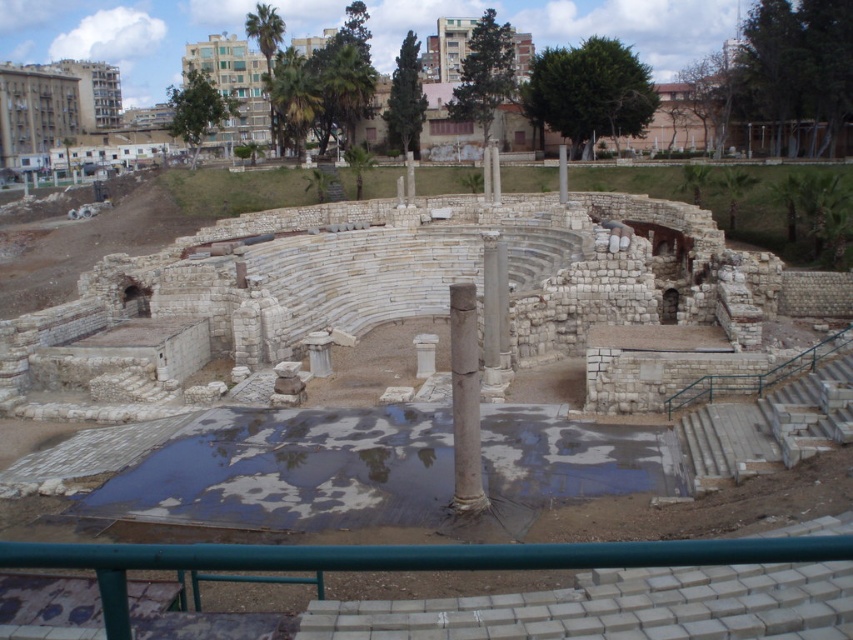
Does white marble column at center appear on the right side of white stone pillar at center?

No, white marble column at center is not to the right of white stone pillar at center.

Measure the distance between white marble column at center and camera.

white marble column at center and camera are 43.19 meters apart from each other.

Does point (463, 486) come behind point (560, 193)?

No, it is not.

The image size is (853, 640). Find the location of `white marble column at center`. white marble column at center is located at coordinates (465, 400).

Does gray stone column at center have a lesser width compared to white stone pillar at center?

Correct, gray stone column at center's width is less than white stone pillar at center's.

In the scene shown: Who is lower down, gray stone column at center or white stone pillar at center?

Positioned lower is gray stone column at center.

At what (x,y) coordinates should I click in order to perform the action: click on gray stone column at center. Please return your answer as a coordinate pair (x, y). The height and width of the screenshot is (640, 853). Looking at the image, I should click on (494, 316).

Where is `gray stone column at center`? This screenshot has width=853, height=640. gray stone column at center is located at coordinates (494, 316).

Between reflective concrete puddle at center and gray stone column at center, which one has more height?

With more height is gray stone column at center.

Who is positioned more to the left, reflective concrete puddle at center or gray stone column at center?

reflective concrete puddle at center is more to the left.

Where is `reflective concrete puddle at center`? reflective concrete puddle at center is located at coordinates (380, 470).